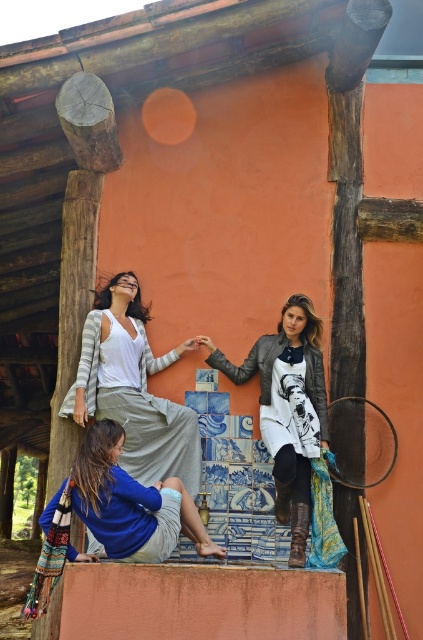
Question: Among these objects, which one is nearest to the camera?

Choices:
 (A) blue cotton shirt at lower left
 (B) striped knit cardigan at upper left

Answer: (A)

Question: Which point is farther from the camera taking this photo?

Choices:
 (A) (99, 451)
 (B) (291, 339)
 (C) (145, 342)

Answer: (C)

Question: Does striped knit cardigan at upper left appear under blue cotton shirt at lower left?

Choices:
 (A) yes
 (B) no

Answer: (B)

Question: Based on their relative distances, which object is farther from the striped knit cardigan at upper left?

Choices:
 (A) leather jacket at center
 (B) blue cotton shirt at lower left

Answer: (A)

Question: Can you confirm if striped knit cardigan at upper left is thinner than blue cotton shirt at lower left?

Choices:
 (A) no
 (B) yes

Answer: (B)

Question: Does striped knit cardigan at upper left have a smaller size compared to blue cotton shirt at lower left?

Choices:
 (A) yes
 (B) no

Answer: (A)